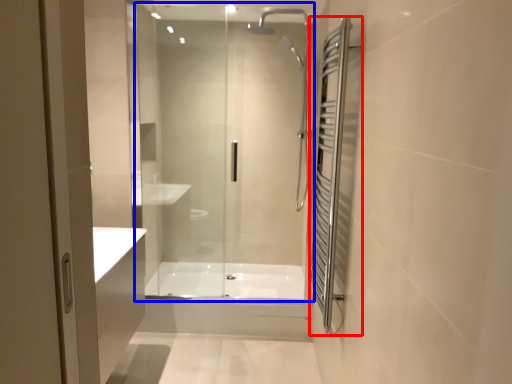
Question: Which object is closer to the camera taking this photo, screen door (highlighted by a red box) or shower door (highlighted by a blue box)?

Choices:
 (A) screen door
 (B) shower door

Answer: (A)